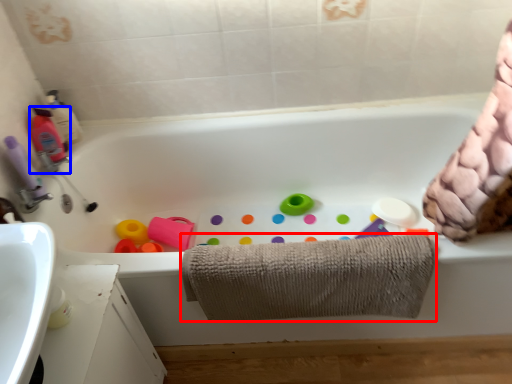
Question: Which object is further to the camera taking this photo, towel (highlighted by a red box) or cleaning product (highlighted by a blue box)?

Choices:
 (A) towel
 (B) cleaning product

Answer: (B)